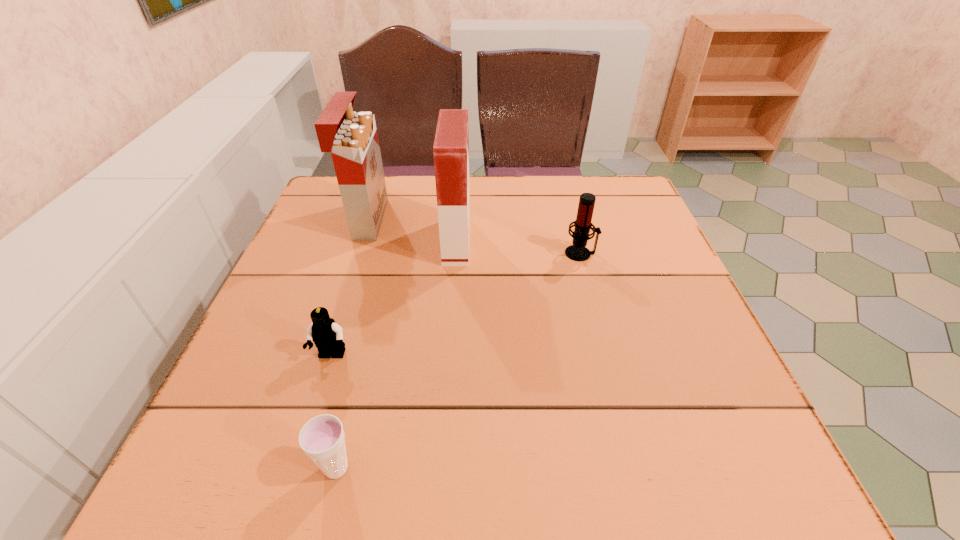
Identify the location of the left cigarette_case. This screenshot has height=540, width=960. (352, 138).

This screenshot has width=960, height=540. I want to click on the right cigarette_case, so click(451, 145).

This screenshot has width=960, height=540. Identify the location of the rightmost object. (577, 252).

This screenshot has width=960, height=540. Identify the location of microphone. (577, 252).

The image size is (960, 540). I want to click on Lego, so click(x=327, y=335).

Where is `the nearest object`? The width and height of the screenshot is (960, 540). the nearest object is located at coordinates (322, 438).

Where is `vacant space located with the lid open on the left cigarette_case`? This screenshot has width=960, height=540. vacant space located with the lid open on the left cigarette_case is located at coordinates (479, 220).

At what (x,y) coordinates should I click in order to perform the action: click on vacant space located on the front-facing side of the right cigarette_case. Please return your answer as a coordinate pair (x, y). The width and height of the screenshot is (960, 540). Looking at the image, I should click on (601, 241).

This screenshot has width=960, height=540. I want to click on free space located 0.330m on the left of the microphone, so click(x=425, y=253).

Identify the location of free location located 0.200m on the front-facing side of the second nearest object. The width and height of the screenshot is (960, 540). (294, 475).